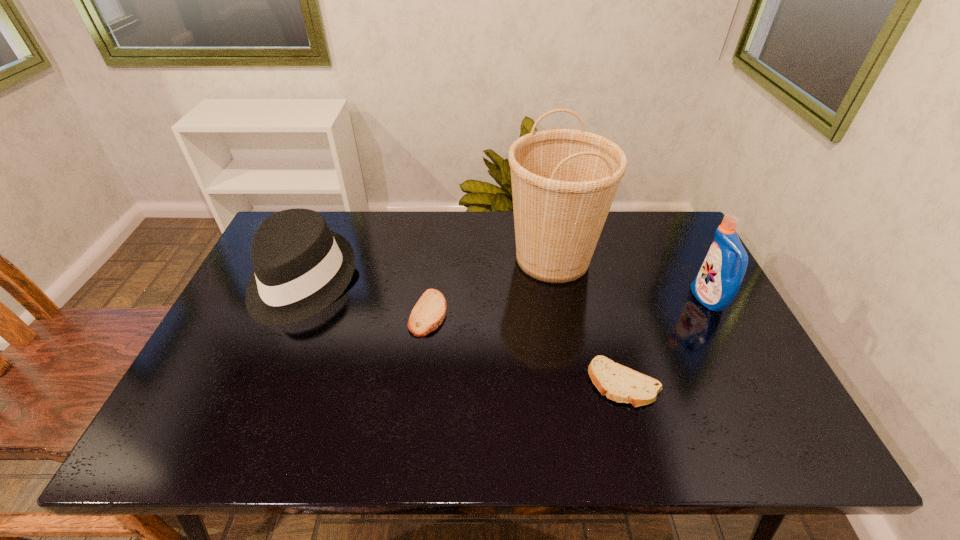
Where is `blank region between the third shortest object and the farther pita bread`? blank region between the third shortest object and the farther pita bread is located at coordinates (365, 297).

You are a GUI agent. You are given a task and a screenshot of the screen. Output one action in this format:
    pyautogui.click(x=<x>, y=<y>)
    Task: Click on the vacant area between the basket and the leftmost object
    
    Given the screenshot: What is the action you would take?
    pyautogui.click(x=427, y=270)

Find the location of a particular element. This screenshot has height=540, width=960. unoccupied position between the fedora and the rightmost object is located at coordinates (505, 291).

The height and width of the screenshot is (540, 960). Find the location of `free space between the shortest object and the basket`. free space between the shortest object and the basket is located at coordinates (588, 321).

Where is `blank region between the tallest object and the shortest object`? Image resolution: width=960 pixels, height=540 pixels. blank region between the tallest object and the shortest object is located at coordinates (588, 321).

You are a GUI agent. You are given a task and a screenshot of the screen. Output one action in this format:
    pyautogui.click(x=<x>, y=<y>)
    Task: Click on the vacant point located between the basket and the farther pita bread
    
    Given the screenshot: What is the action you would take?
    pyautogui.click(x=491, y=286)

At what (x,y) coordinates should I click in order to perform the action: click on vacant space in between the tallest object and the nearer pita bread. Please return your answer as a coordinate pair (x, y). Looking at the image, I should click on (588, 321).

In order to click on object that is the fourth closest to the basket in this screenshot , I will do `click(301, 267)`.

Where is `object that is the closest one to the farther pita bread`? The width and height of the screenshot is (960, 540). object that is the closest one to the farther pita bread is located at coordinates click(x=564, y=181).

The height and width of the screenshot is (540, 960). Find the location of `free spot that satisfies the following two spatial constraints: 1. on the front side of the nearer pita bread; 2. on the right side of the left pita bread`. free spot that satisfies the following two spatial constraints: 1. on the front side of the nearer pita bread; 2. on the right side of the left pita bread is located at coordinates (420, 383).